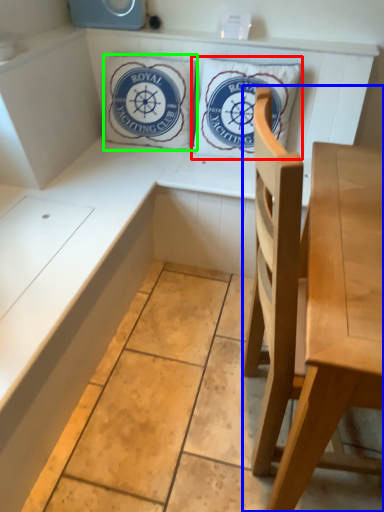
Question: Which object is the farthest from pillow (highlighted by a red box)? Choose among these: chair (highlighted by a blue box) or pillow (highlighted by a green box).

Choices:
 (A) chair
 (B) pillow

Answer: (A)